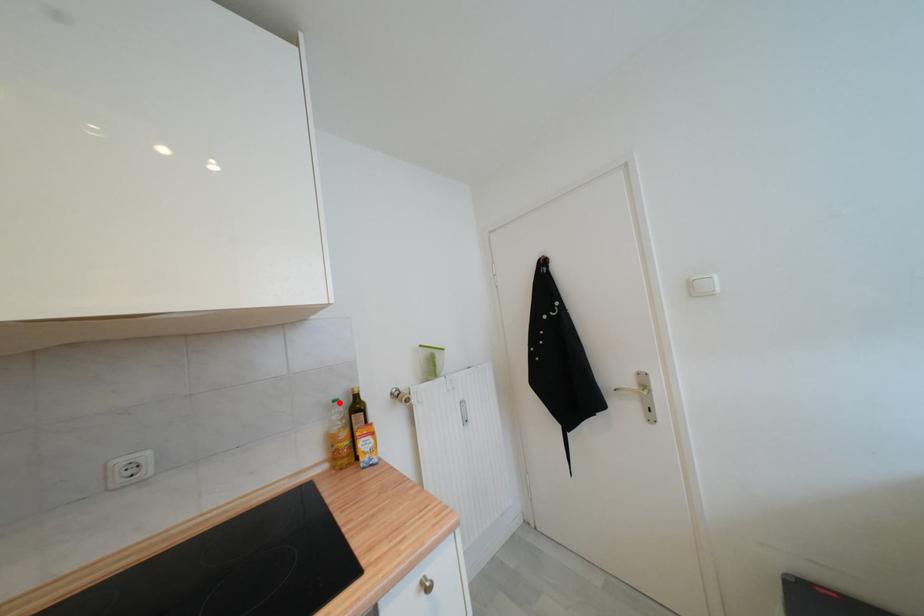
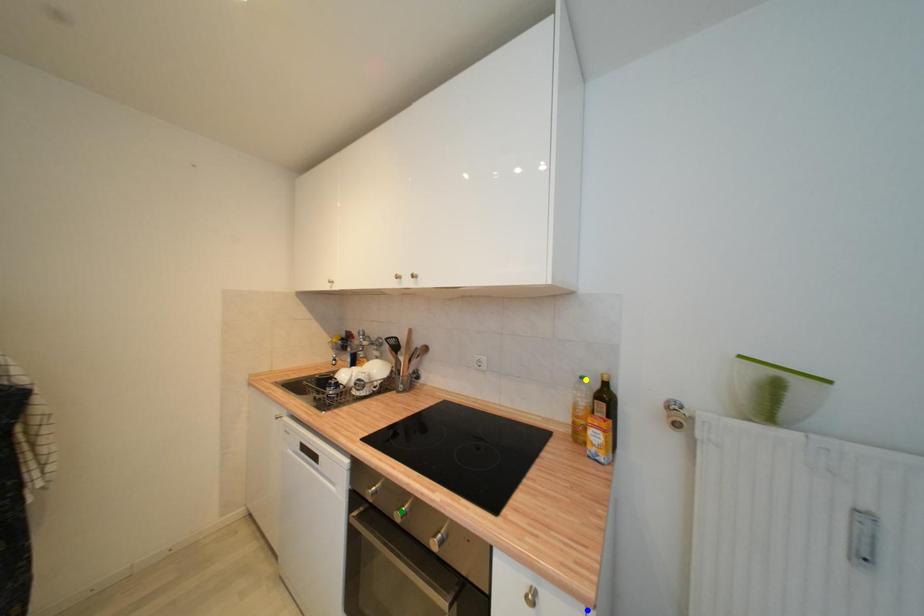
Question: I am providing you with two images of the same scene from different viewpoints. A red point is marked on the first image. You are given multiple points on the second image. Which point in image 2 represents the same 3d spot as the red point in image 1?

Choices:
 (A) yellow point
 (B) blue point
 (C) green point

Answer: (A)